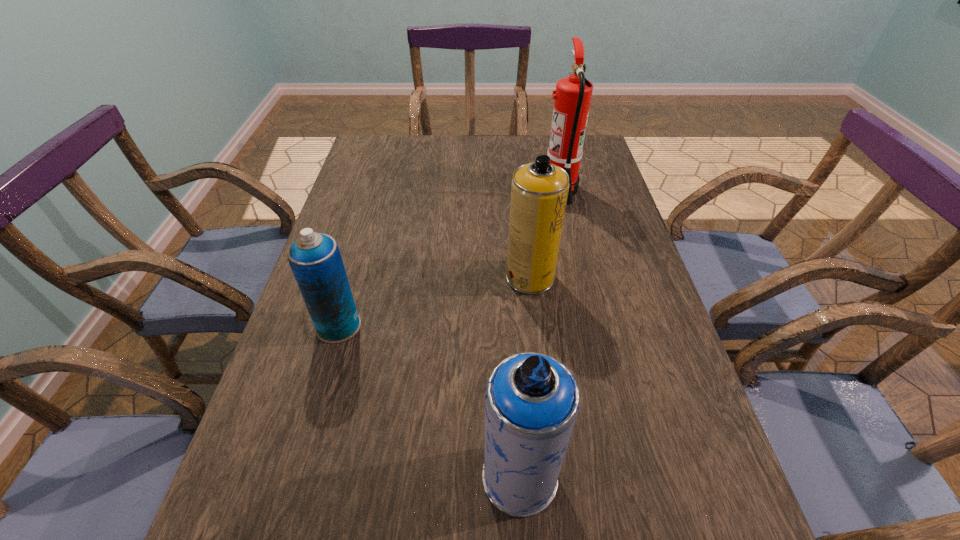
Find the location of a particular element. This screenshot has height=540, width=960. free space located on the left of the nearest object is located at coordinates (272, 477).

Where is `free spot located 0.120m on the back of the leftmost aerosol can`? The height and width of the screenshot is (540, 960). free spot located 0.120m on the back of the leftmost aerosol can is located at coordinates (354, 272).

Where is `object that is at the far edge`? object that is at the far edge is located at coordinates coord(573,94).

Find the location of a particular element. The height and width of the screenshot is (540, 960). object that is positioned at the left edge is located at coordinates (315, 260).

Find the location of a particular element. The image size is (960, 540). object that is at the right edge is located at coordinates (573, 94).

The image size is (960, 540). I want to click on object that is at the far right corner, so click(x=573, y=94).

The height and width of the screenshot is (540, 960). What are the coordinates of `free space at the far edge of the desktop` in the screenshot? It's located at (467, 170).

The height and width of the screenshot is (540, 960). In order to click on free space at the left edge of the desktop in this screenshot , I will do `click(373, 184)`.

The image size is (960, 540). Find the location of `blank space at the right edge of the desktop`. blank space at the right edge of the desktop is located at coordinates (577, 258).

Where is `free spot at the far left corner of the desktop`? free spot at the far left corner of the desktop is located at coordinates (404, 142).